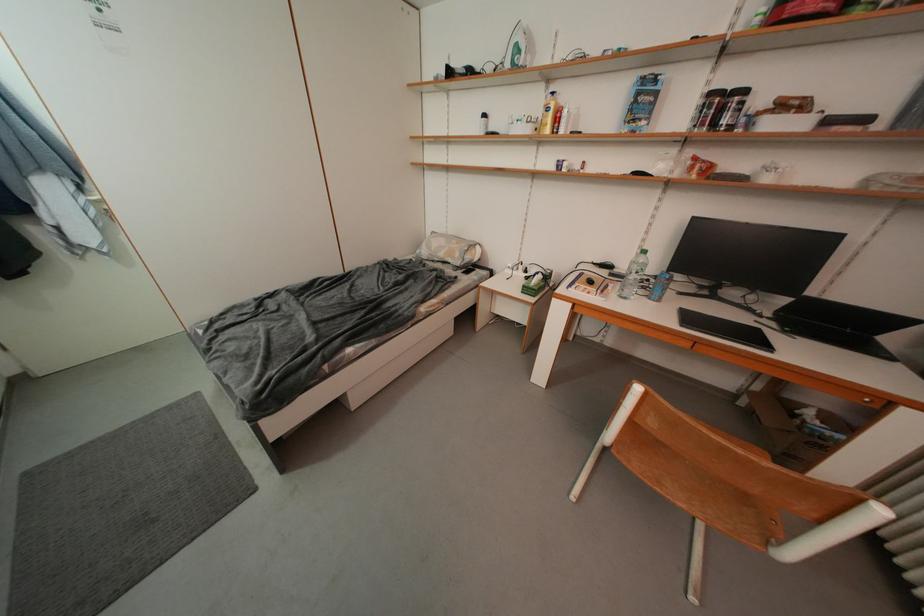
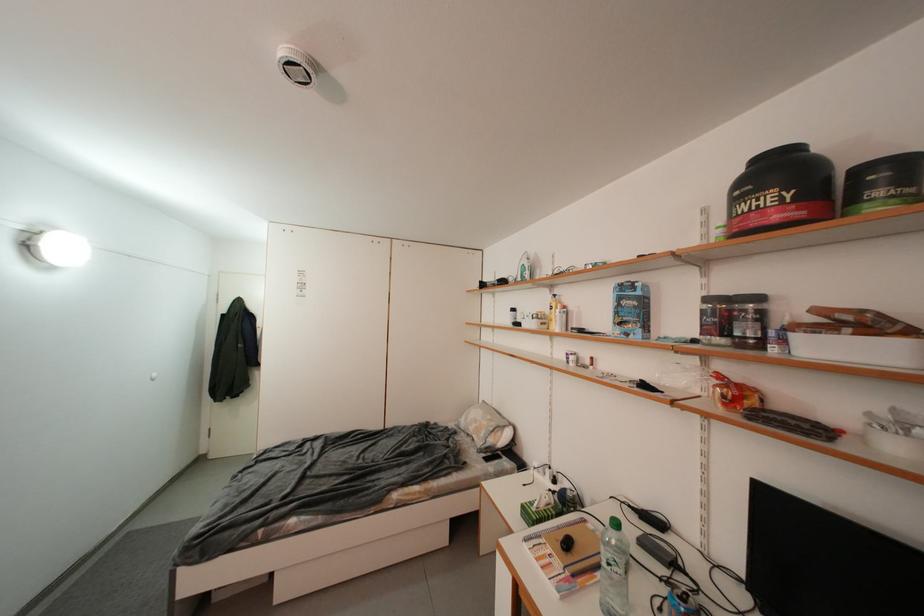
In the second image, find the point that corresponds to the point at 646,97 in the first image.

(627, 302)